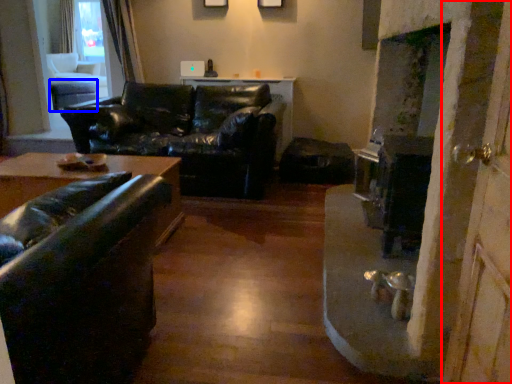
Question: Which object appears farthest to the camera in this image, screen door (highlighted by a red box) or table (highlighted by a blue box)?

Choices:
 (A) screen door
 (B) table

Answer: (B)